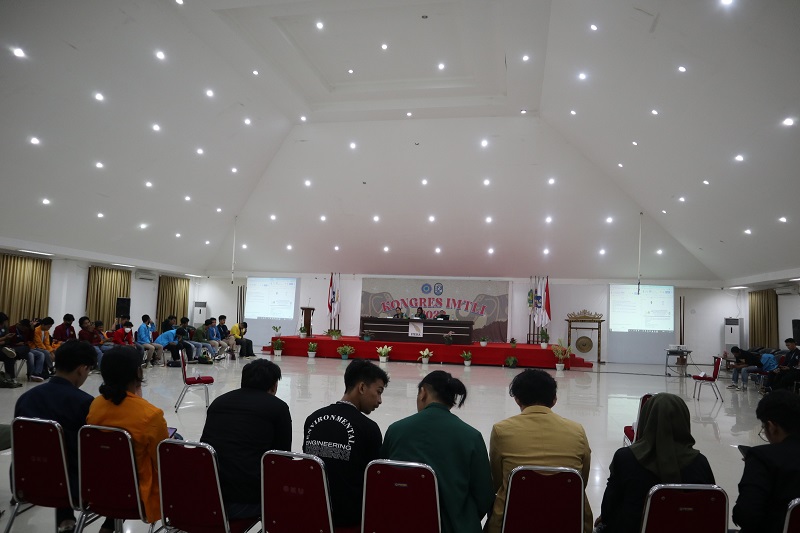
Identify the location of screens. (640, 306), (286, 290).